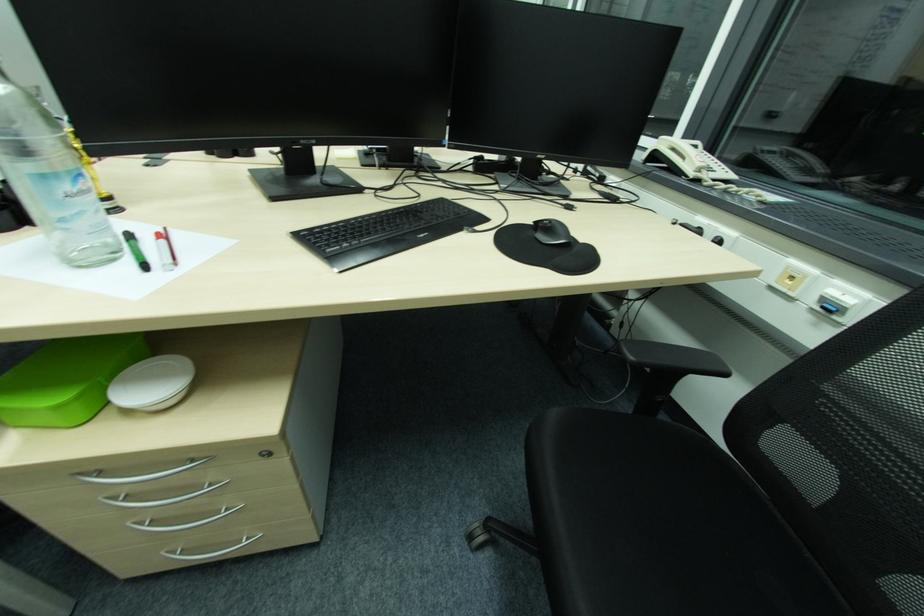
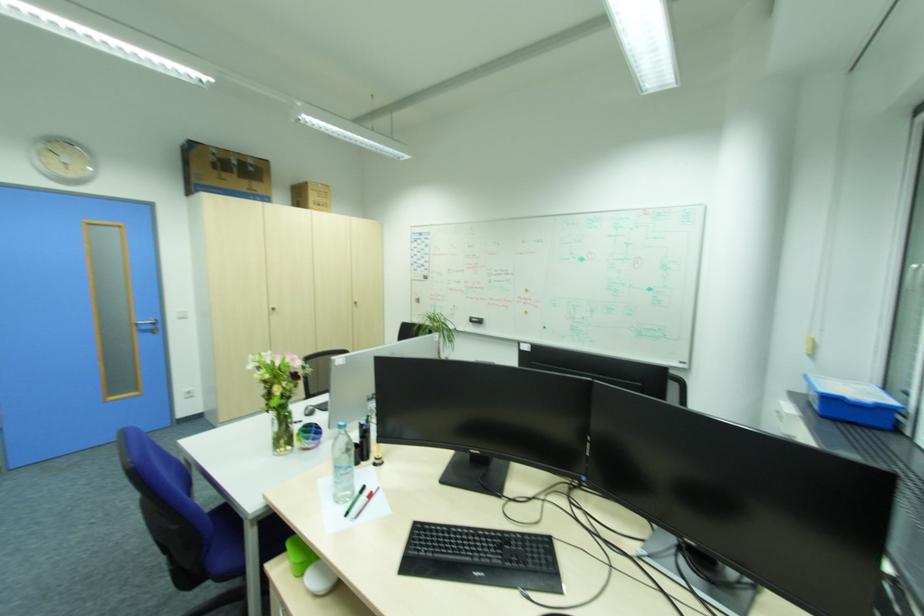
The images are taken continuously from a first-person perspective. In which direction is your viewpoint rotating?

The camera's rotation is toward left-up.